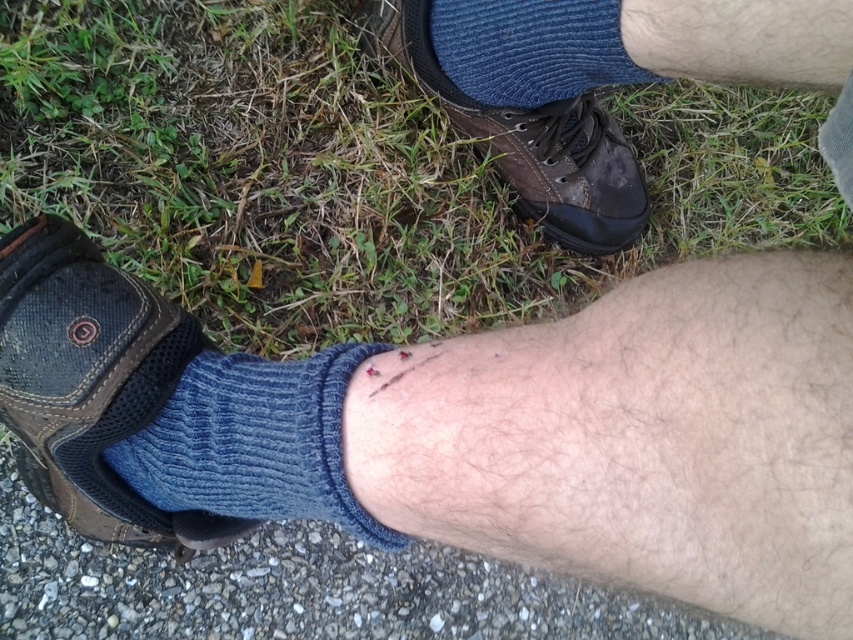
You are a hiker who just twisted your ankle and need to check your footwear. Based on the image, is the blue knitted sock at lower center located above or below the leather shoe at center?

The blue knitted sock at lower center is below the leather shoe at center according to the description.

You are a hiker who just twisted your ankle and need to check your footwear. Looking at the image, which object is shorter in height between the blue knitted sock at lower center and the leather shoe at center?

The blue knitted sock at lower center is shorter in height compared to the leather shoe at center.

You are a hiker who just noticed your blue knitted sock at lower center and blue knitted sock at upper center. Which sock is wider?

The blue knitted sock at lower center is wider than the blue knitted sock at upper center.